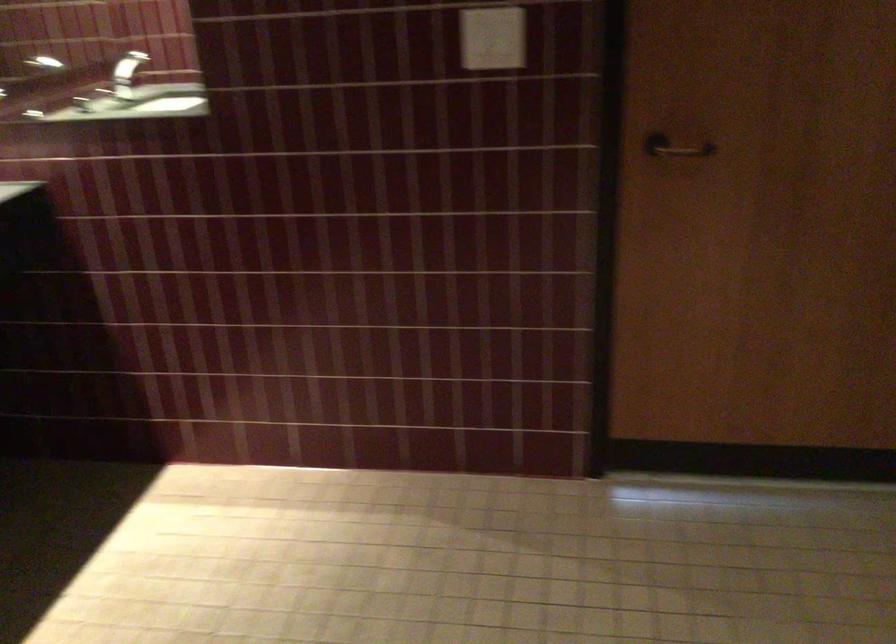
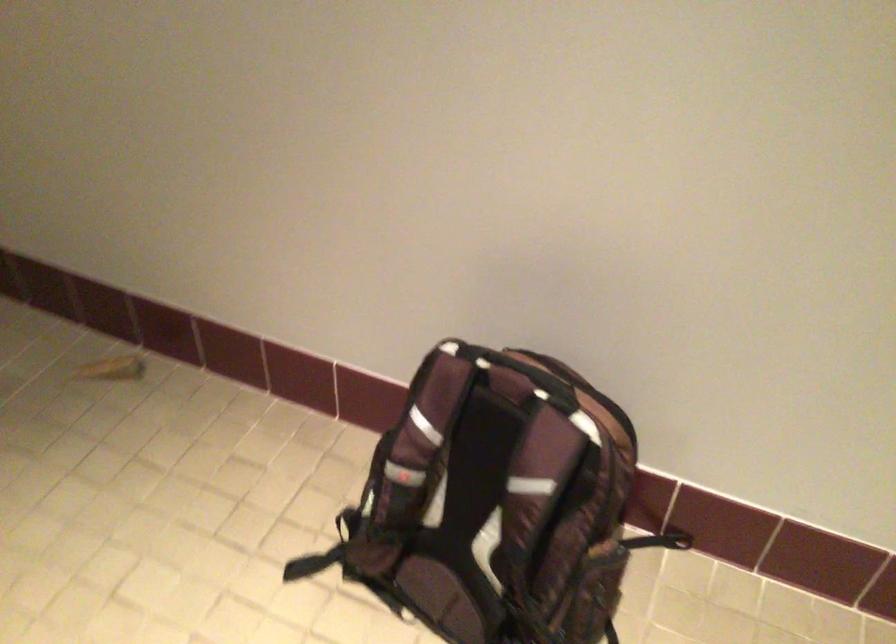
The images are taken continuously from a first-person perspective. In which direction is your viewpoint rotating?

The camera's rotation is toward right-down.